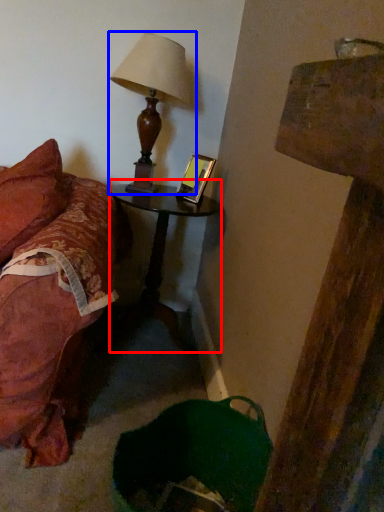
Question: Among these objects, which one is nearest to the camera, nightstand (highlighted by a red box) or lamp (highlighted by a blue box)?

Choices:
 (A) nightstand
 (B) lamp

Answer: (B)